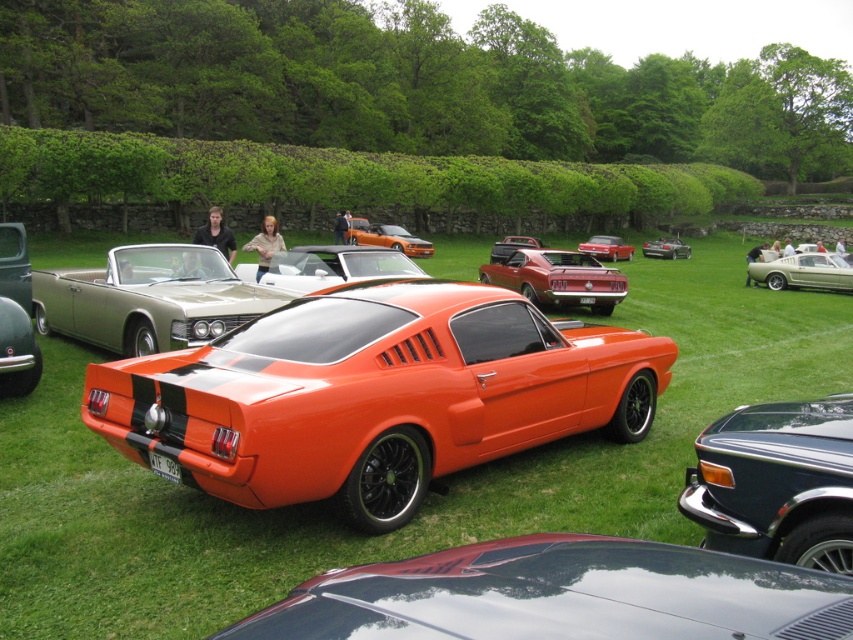
Looking at this image, you are standing at the center of the grassy field where the classic car show is taking place. You notice two points marked on the ground at coordinates point (714, 321) and point (1, 332). If you were to walk from the first point to the second, would you be moving towards the car or away from it?

Since point (714, 321) is behind point (1, 332), walking from the first point to the second would mean moving towards the car.

You are a photographer setting up a tripod in the middle of the green grass at center and the glossy metallic car at center. Since you need to place the tripod on stable ground, which area should you choose? Please explain your reasoning based on the scene description.

The glossy metallic car at center is the better choice for placing the tripod because the green grass at center is much taller, making it unstable and uneven ground compared to the car which is solid and flat.

Looking at this image, you are a photographer standing at the edge of the grassy field where the car show is taking place. You want to take a photo that includes both the green grass at center and the shiny black car at center. Which object will appear larger in your photo?

The green grass at center will appear larger in the photo because it is closer to the viewer than the shiny black car at center.